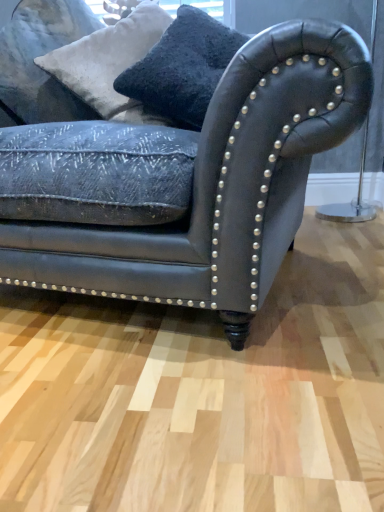
Question: Is white textured pillow at upper left, the first pillow viewed from the left, shorter than leather couch at center?

Choices:
 (A) no
 (B) yes

Answer: (B)

Question: Is white textured pillow at upper left, the 2th pillow in the right-to-left sequence, smaller than leather couch at center?

Choices:
 (A) yes
 (B) no

Answer: (A)

Question: Is white textured pillow at upper left, the 2th pillow in the right-to-left sequence, oriented towards leather couch at center?

Choices:
 (A) no
 (B) yes

Answer: (B)

Question: Does white textured pillow at upper left, the first pillow viewed from the left, lie behind leather couch at center?

Choices:
 (A) no
 (B) yes

Answer: (B)

Question: Is white textured pillow at upper left, the 2th pillow in the right-to-left sequence, positioned before leather couch at center?

Choices:
 (A) yes
 (B) no

Answer: (B)

Question: Can you confirm if white textured pillow at upper left, the first pillow viewed from the left, is bigger than leather couch at center?

Choices:
 (A) yes
 (B) no

Answer: (B)

Question: Is white textured pillow at upper left, the first pillow viewed from the left, at the left side of velvety black pillow at upper center, the 1th pillow from the right?

Choices:
 (A) yes
 (B) no

Answer: (A)

Question: Is white textured pillow at upper left, the 2th pillow in the right-to-left sequence, bigger than velvety black pillow at upper center, the 1th pillow from the right?

Choices:
 (A) no
 (B) yes

Answer: (B)

Question: Does white textured pillow at upper left, the 2th pillow in the right-to-left sequence, have a lesser height compared to velvety black pillow at upper center, the 2th pillow when ordered from left to right?

Choices:
 (A) yes
 (B) no

Answer: (B)

Question: Can velvety black pillow at upper center, the 1th pillow from the right, be found inside white textured pillow at upper left, the 2th pillow in the right-to-left sequence?

Choices:
 (A) no
 (B) yes

Answer: (A)

Question: Is there a large distance between white textured pillow at upper left, the 2th pillow in the right-to-left sequence, and velvety black pillow at upper center, the 2th pillow when ordered from left to right?

Choices:
 (A) no
 (B) yes

Answer: (A)

Question: Considering the relative sizes of white textured pillow at upper left, the 2th pillow in the right-to-left sequence, and velvety black pillow at upper center, the 1th pillow from the right, in the image provided, is white textured pillow at upper left, the 2th pillow in the right-to-left sequence, smaller than velvety black pillow at upper center, the 1th pillow from the right,?

Choices:
 (A) yes
 (B) no

Answer: (B)

Question: Considering the relative sizes of leather couch at center and velvety black pillow at upper center, the 2th pillow when ordered from left to right, in the image provided, is leather couch at center shorter than velvety black pillow at upper center, the 2th pillow when ordered from left to right,?

Choices:
 (A) no
 (B) yes

Answer: (A)